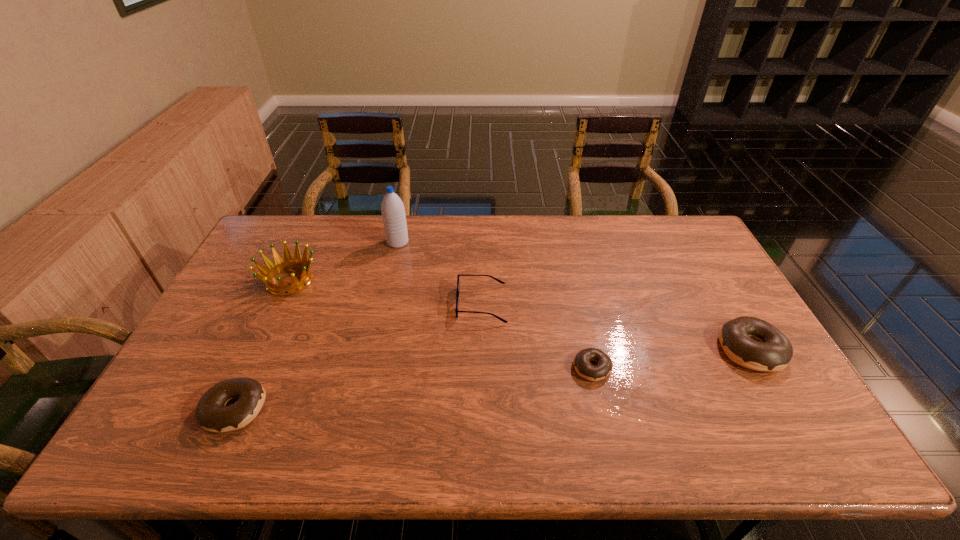
Select which doughnut is the closest to the shortest doughnut. Please provide its 2D coordinates. Your answer should be formatted as a tuple, i.e. [(x, y)], where the tuple contains the x and y coordinates of a point satisfying the conditions above.

[(772, 351)]

Point out which doughnut is positioned as the nearest to the second doughnut from left to right. Please provide its 2D coordinates. Your answer should be formatted as a tuple, i.e. [(x, y)], where the tuple contains the x and y coordinates of a point satisfying the conditions above.

[(772, 351)]

You are a GUI agent. You are given a task and a screenshot of the screen. Output one action in this format:
    pyautogui.click(x=<x>, y=<y>)
    Task: Click on the free space that satisfies the following two spatial constraints: 1. on the front side of the fifth shortest object; 2. on the right side of the second tallest doughnut
    The image size is (960, 540).
    Given the screenshot: What is the action you would take?
    pyautogui.click(x=229, y=408)

The height and width of the screenshot is (540, 960). What are the coordinates of `free location that satisfies the following two spatial constraints: 1. on the back side of the shortest object; 2. on the right side of the second shortest doughnut` in the screenshot? It's located at (253, 368).

Locate an element on the screen. free space that satisfies the following two spatial constraints: 1. on the back side of the second tallest doughnut; 2. on the left side of the rightmost doughnut is located at coordinates (262, 349).

Where is `free space that satisfies the following two spatial constraints: 1. on the back side of the second doughnut from right to left; 2. on the left side of the leftmost doughnut`? free space that satisfies the following two spatial constraints: 1. on the back side of the second doughnut from right to left; 2. on the left side of the leftmost doughnut is located at coordinates [253, 368].